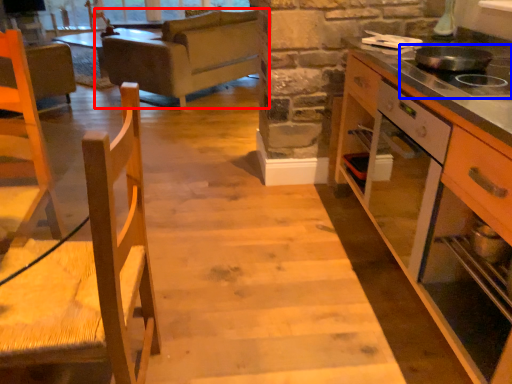
Question: Which object is closer to the camera taking this photo, studio couch (highlighted by a red box) or gas stove (highlighted by a blue box)?

Choices:
 (A) studio couch
 (B) gas stove

Answer: (B)